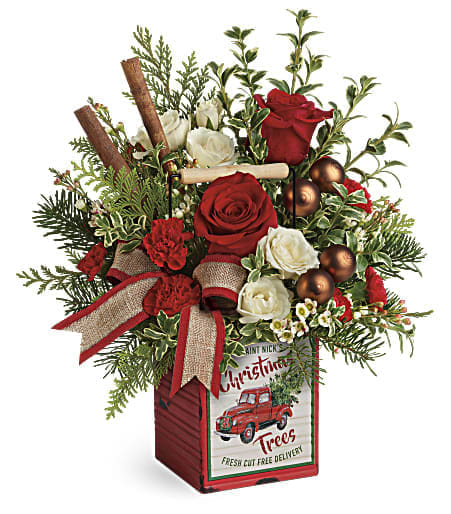
Locate an element on the screen. This screenshot has height=514, width=451. ornaments is located at coordinates (338, 269), (321, 285).